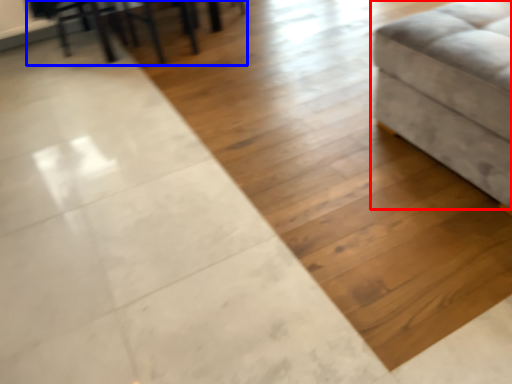
Question: Which point is closer to the camera, furniture (highlighted by a red box) or table (highlighted by a blue box)?

Choices:
 (A) furniture
 (B) table

Answer: (A)